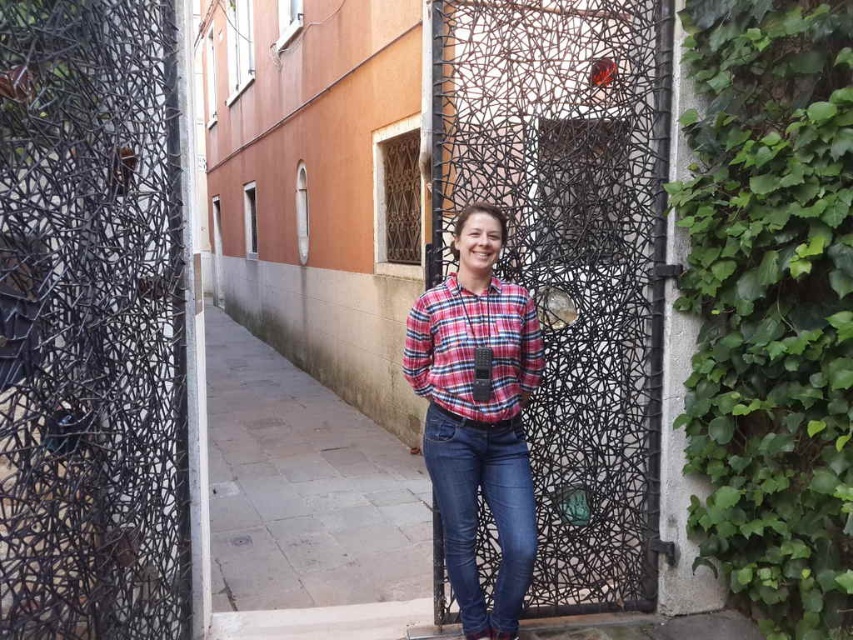
Question: Can you confirm if black wire mesh at center is positioned to the right of black textured door at center?

Choices:
 (A) no
 (B) yes

Answer: (A)

Question: Estimate the real-world distances between objects in this image. Which object is farther from the plaid fabric shirt at center?

Choices:
 (A) green leafy ivy at right
 (B) black wire mesh at center

Answer: (B)

Question: Which of the following is the closest to the observer?

Choices:
 (A) gray concrete pavement at center
 (B) black textured door at center
 (C) plaid fabric shirt at center
 (D) black wire mesh at center

Answer: (D)

Question: Can you confirm if black wire mesh at center is positioned below denim jeans at center?

Choices:
 (A) no
 (B) yes

Answer: (A)

Question: Which of the following is the farthest from the observer?

Choices:
 (A) denim jeans at center
 (B) plaid fabric shirt at center

Answer: (B)

Question: Is plaid cotton shirt at center below denim jeans at center?

Choices:
 (A) no
 (B) yes

Answer: (A)